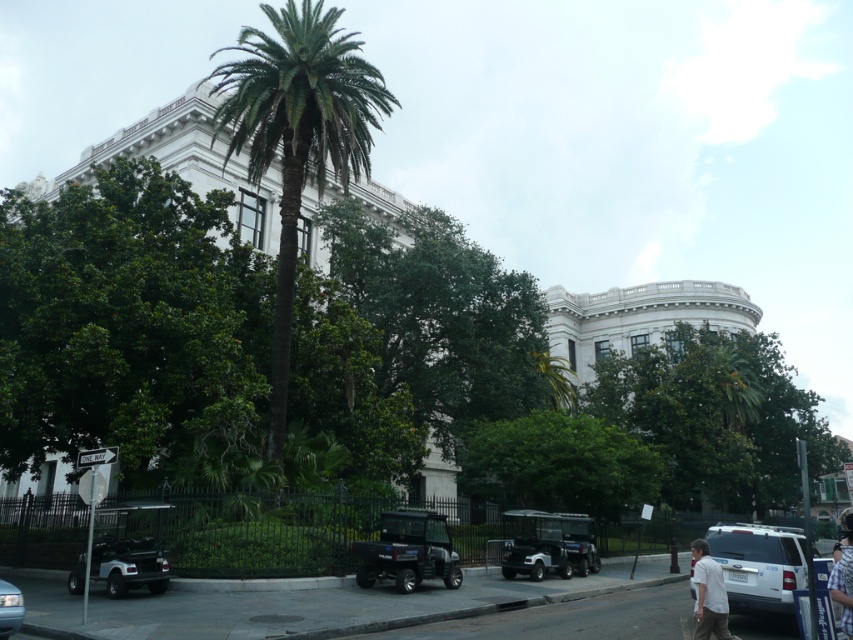
You are a visitor at this classical building and see both the white matte suv at lower right and the white shirt at lower right. Which object is closer to the fence that separates the street from the building?

The white shirt at lower right is closer to the fence because the white matte suv at lower right is on its right side, placing the shirt nearer to the fence.

You are a visitor at this classical building and see the black matte golf cart at center and the white cotton shirt at lower right. Which object takes up more space in the image?

The black matte golf cart at center is larger in size than the white cotton shirt at lower right, so it takes up more space in the image.